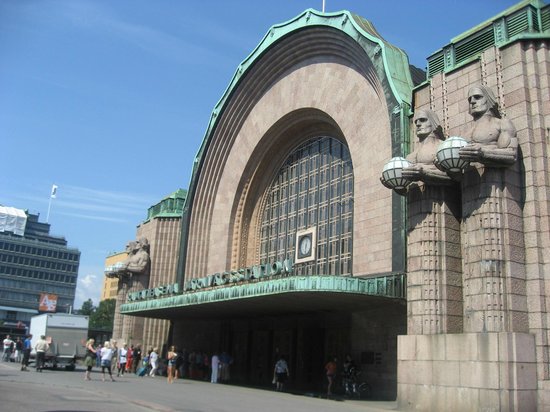
Locate an element on the screen. blurry clock is located at coordinates (302, 243), (307, 244), (308, 250).